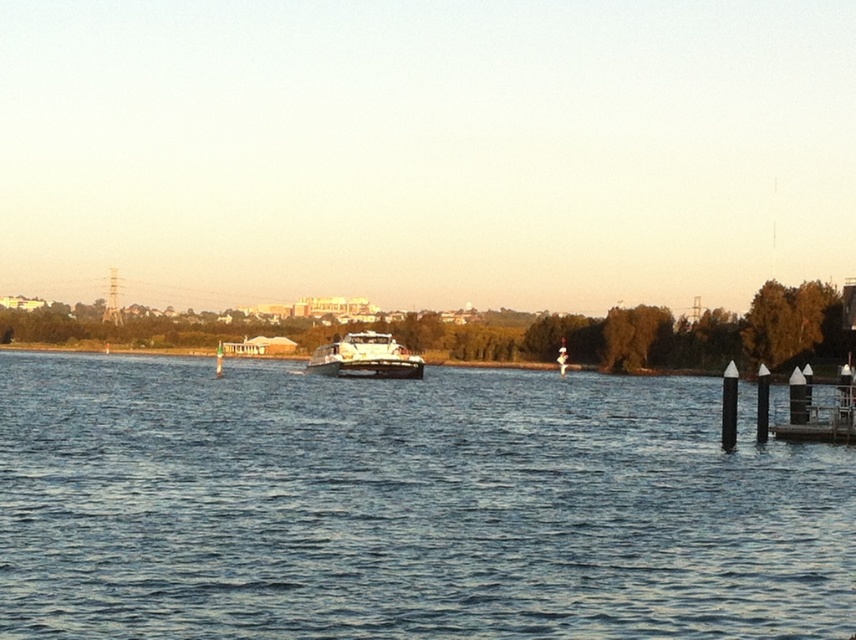
You are standing at the point with coordinates point [346,365] and want to move towards the point with coordinates point [384,419]. Which direction should you go?

You should move forward because point [384,419] is in front of point [346,365].